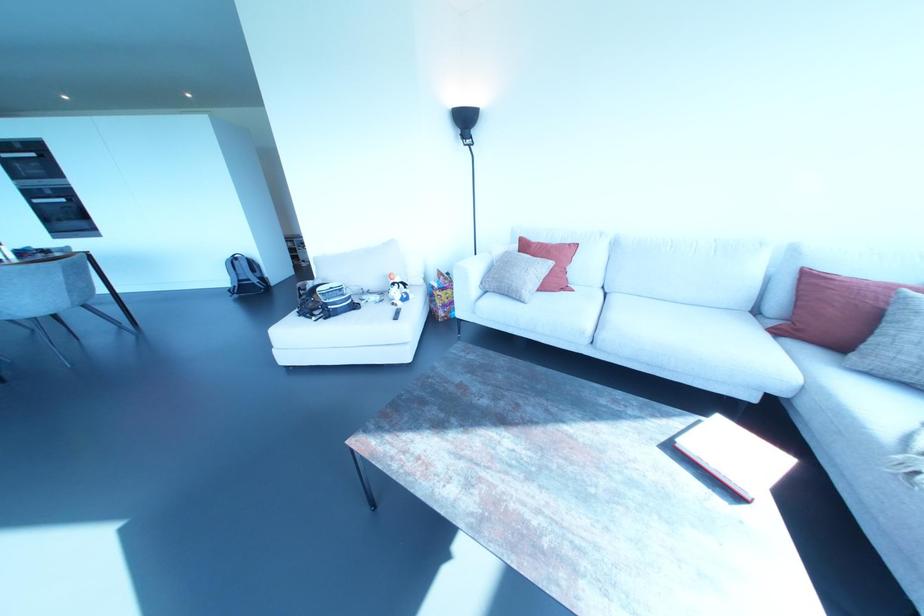
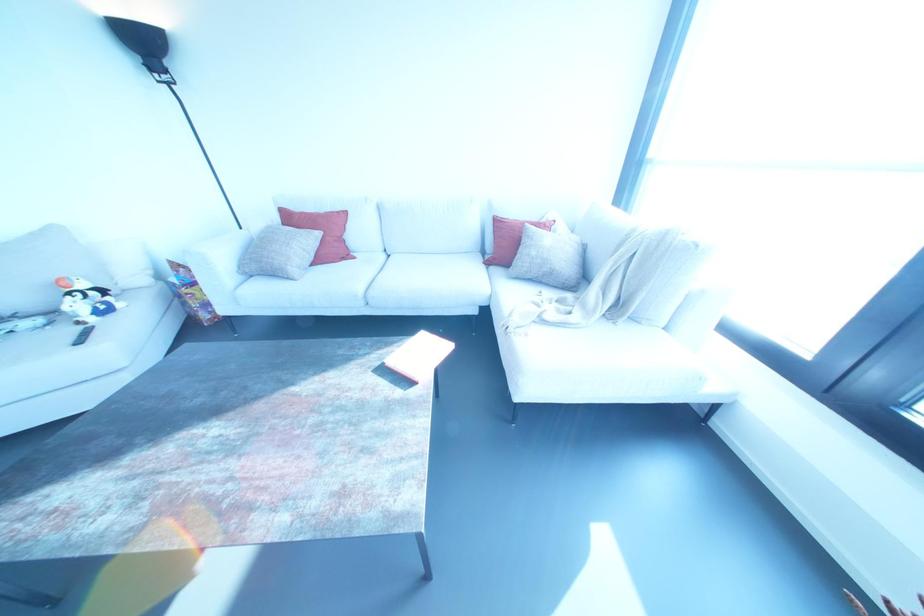
Where in the second image is the point corresponding to [465,121] from the first image?

(142, 44)